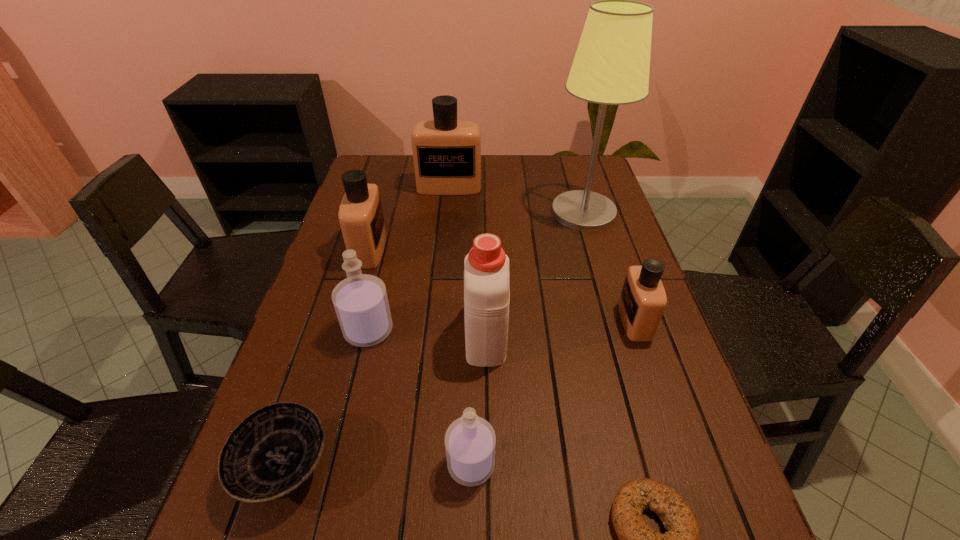
Identify which object is the third nearest to the biggest beige perfume. Please provide its 2D coordinates. Your answer should be formatted as a tuple, i.e. [(x, y)], where the tuple contains the x and y coordinates of a point satisfying the conditions above.

[(486, 267)]

Select which perfume is the fourth closest to the second smallest beige perfume. Please provide its 2D coordinates. Your answer should be formatted as a tuple, i.e. [(x, y)], where the tuple contains the x and y coordinates of a point satisfying the conditions above.

[(642, 302)]

Image resolution: width=960 pixels, height=540 pixels. I want to click on perfume identified as the closest to the bowl, so click(x=360, y=301).

I want to click on the closest beige perfume to the white detergent, so (x=361, y=218).

Locate which beige perfume ranks third in proximity to the right purple perfume. Please provide its 2D coordinates. Your answer should be formatted as a tuple, i.e. [(x, y)], where the tuple contains the x and y coordinates of a point satisfying the conditions above.

[(447, 152)]

At what (x,y) coordinates should I click in order to perform the action: click on vacant space that satisfies the following two spatial constraints: 1. on the front label of the left purple perfume; 2. on the right side of the second farthest beige perfume. Please return your answer as a coordinate pair (x, y). The width and height of the screenshot is (960, 540). Looking at the image, I should click on (346, 330).

This screenshot has width=960, height=540. In order to click on vacant space that satisfies the following two spatial constraints: 1. on the front label of the right purple perfume; 2. on the right side of the tallest perfume in this screenshot , I will do `click(422, 464)`.

Find the location of a particular element. Image resolution: width=960 pixels, height=540 pixels. free space in the image that satisfies the following two spatial constraints: 1. on the front label of the second farthest perfume; 2. on the handle side of the detergent is located at coordinates (345, 334).

Locate an element on the screen. The width and height of the screenshot is (960, 540). free space that satisfies the following two spatial constraints: 1. on the front label of the second farthest beige perfume; 2. on the right side of the bigger purple perfume is located at coordinates (346, 330).